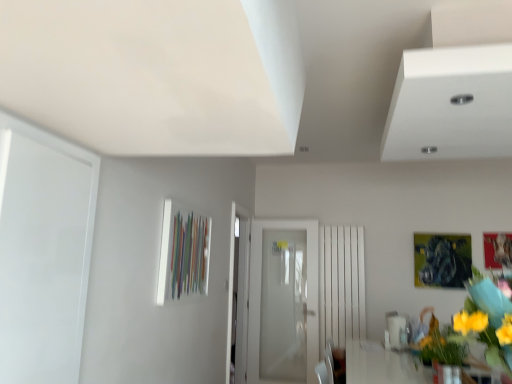
Question: Looking at their shapes, would you say yellow fabric flower at right is wider or thinner than white frosted glass door at center?

Choices:
 (A) wide
 (B) thin

Answer: (A)

Question: Is yellow fabric flower at right taller or shorter than white frosted glass door at center?

Choices:
 (A) tall
 (B) short

Answer: (B)

Question: From a real-world perspective, is yellow fabric flower at right physically located above or below white frosted glass door at center?

Choices:
 (A) below
 (B) above

Answer: (B)

Question: Would you say white frosted glass door at center is inside or outside yellow fabric flower at right?

Choices:
 (A) outside
 (B) inside

Answer: (A)

Question: Does point (310, 336) appear closer or farther from the camera than point (501, 319)?

Choices:
 (A) closer
 (B) farther

Answer: (B)

Question: From the image's perspective, is white frosted glass door at center above or below yellow fabric flower at right?

Choices:
 (A) above
 (B) below

Answer: (B)

Question: Looking at their shapes, would you say white frosted glass door at center is wider or thinner than yellow fabric flower at right?

Choices:
 (A) thin
 (B) wide

Answer: (A)